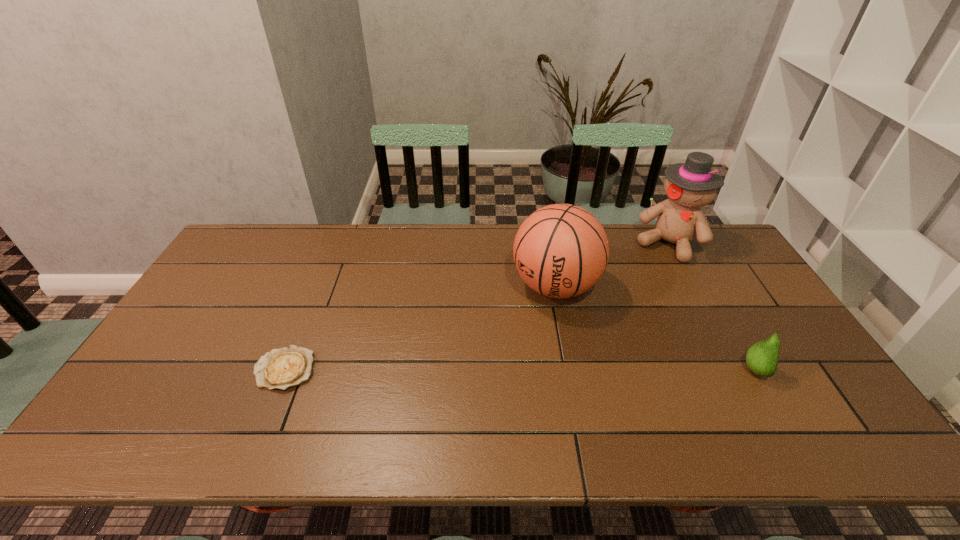
You are a GUI agent. You are given a task and a screenshot of the screen. Output one action in this format:
    pyautogui.click(x=<x>, y=<y>)
    Task: Click on the free space located 0.060m on the front-facing side of the rag_doll
    
    Given the screenshot: What is the action you would take?
    pyautogui.click(x=651, y=271)

You are a GUI agent. You are given a task and a screenshot of the screen. Output one action in this format:
    pyautogui.click(x=<x>, y=<y>)
    Task: Click on the vacant point located on the front-facing side of the rag_doll
    
    Given the screenshot: What is the action you would take?
    pyautogui.click(x=626, y=309)

Identify the location of vacant space located on the front-facing side of the rag_doll. (610, 334).

Locate an element on the screen. This screenshot has height=540, width=960. basketball present at the far edge is located at coordinates (561, 250).

At what (x,y) coordinates should I click in order to perform the action: click on rag_doll that is at the far edge. Please return your answer as a coordinate pair (x, y). The image size is (960, 540). Looking at the image, I should click on (690, 185).

Where is `quiche that is at the near edge`? quiche that is at the near edge is located at coordinates (282, 368).

This screenshot has height=540, width=960. What are the coordinates of `avocado situated at the near edge` in the screenshot? It's located at (762, 358).

At what (x,y) coordinates should I click in order to perform the action: click on avocado that is positioned at the right edge. Please return your answer as a coordinate pair (x, y). Looking at the image, I should click on (762, 358).

Find the location of a particular element. The height and width of the screenshot is (540, 960). rag_doll that is at the right edge is located at coordinates (690, 185).

Find the location of `object at the far right corner`. object at the far right corner is located at coordinates (690, 185).